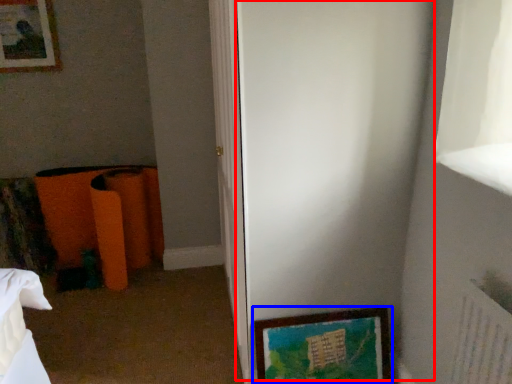
Question: Which object appears closest to the camera in this image, screen door (highlighted by a red box) or picture frame (highlighted by a blue box)?

Choices:
 (A) screen door
 (B) picture frame

Answer: (A)